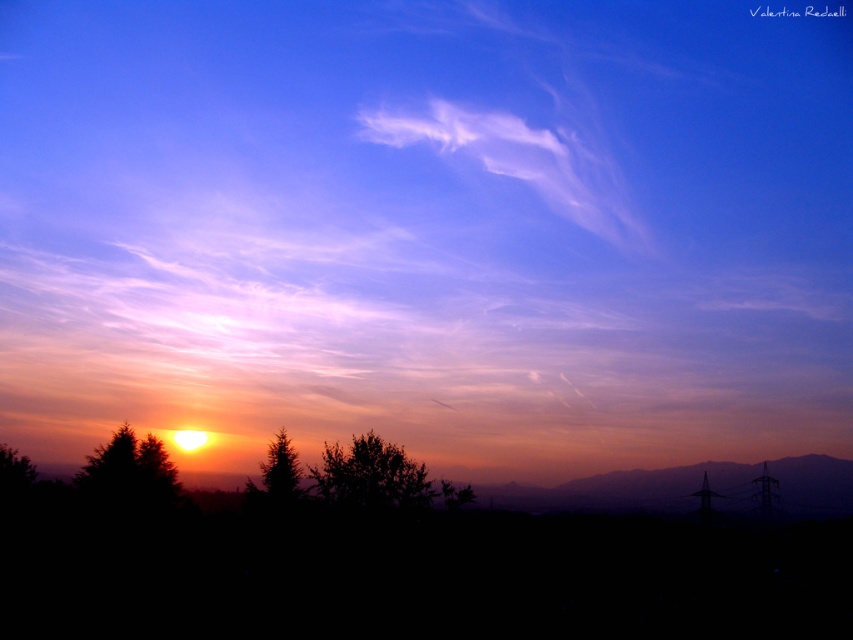
Question: Considering the relative positions of white fluffy cloud at upper center and green leafy tree at center in the image provided, where is white fluffy cloud at upper center located with respect to green leafy tree at center?

Choices:
 (A) left
 (B) right

Answer: (B)

Question: Among these points, which one is nearest to the camera?

Choices:
 (A) (293, 461)
 (B) (316, 470)

Answer: (A)

Question: Which of the following is the closest to the observer?

Choices:
 (A) (258, 490)
 (B) (437, 112)
 (C) (404, 474)
 (D) (788, 467)

Answer: (A)

Question: Does white fluffy cloud at upper center appear on the left side of green leafy tree at center?

Choices:
 (A) yes
 (B) no

Answer: (B)

Question: Which of the following is the farthest from the observer?

Choices:
 (A) (631, 493)
 (B) (346, 456)
 (C) (251, 483)
 (D) (427, 108)

Answer: (D)

Question: Is green leafy tree at center to the right of green matte tree at center from the viewer's perspective?

Choices:
 (A) no
 (B) yes

Answer: (B)